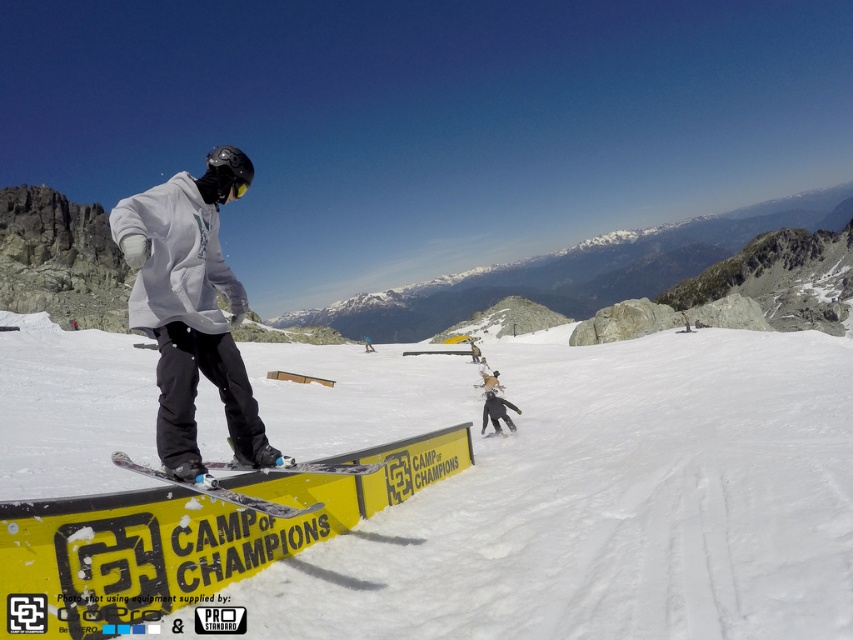
Does matte gray snowboard at center appear on the right side of white matte snowboarder at center?

In fact, matte gray snowboard at center is to the left of white matte snowboarder at center.

Between matte gray snowboard at center and white matte snowboarder at center, which one has less height?

With less height is white matte snowboarder at center.

The image size is (853, 640). What do you see at coordinates (190, 307) in the screenshot?
I see `matte gray snowboard at center` at bounding box center [190, 307].

Locate an element on the screen. matte gray snowboard at center is located at coordinates (190, 307).

Between white matte snow at center and white matte snowboarder at center, which one has less height?

Standing shorter between the two is white matte snowboarder at center.

Which is in front, point (370, 625) or point (494, 424)?

Point (370, 625)

I want to click on white matte snow at center, so click(619, 504).

Who is more distant from viewer, (161, 451) or (248, 497)?

Point (248, 497)

Looking at this image, which of these two, matte gray snowboard at center or metallic silver snowboard at center, stands taller?

Standing taller between the two is matte gray snowboard at center.

This screenshot has width=853, height=640. I want to click on matte gray snowboard at center, so click(190, 307).